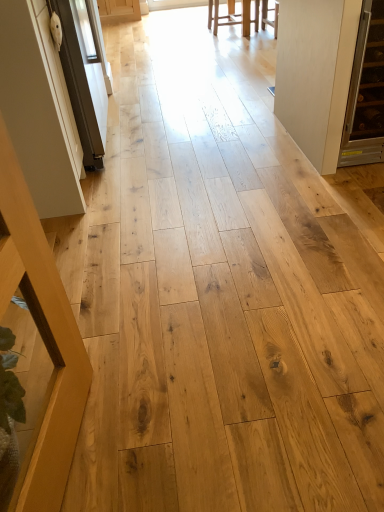
Image resolution: width=384 pixels, height=512 pixels. I want to click on vacant area located to the right-hand side of natural wood table at left, marked as the 2th furniture in a top-to-bottom arrangement, so click(x=177, y=435).